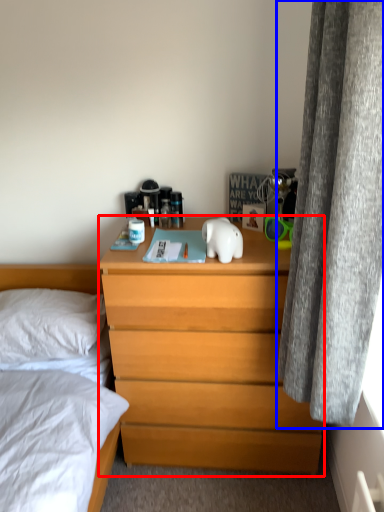
Question: Which of the following is the closest to the observer, chest of drawers (highlighted by a red box) or curtain (highlighted by a blue box)?

Choices:
 (A) chest of drawers
 (B) curtain

Answer: (B)